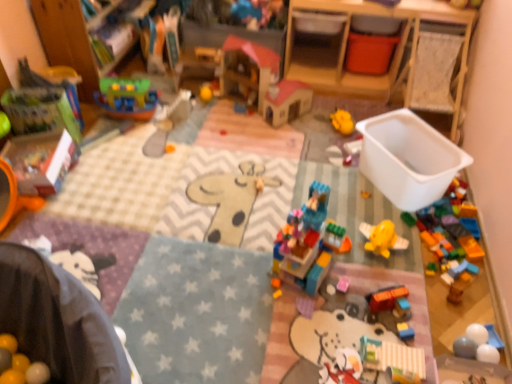
This screenshot has width=512, height=384. Find the location of `vacant area that lies between yellow matte ball at center, which is the 8th toy from bottom to top, and translucent plastic castle at center, marked as the third toy in a bottom-to-top arrangement`. vacant area that lies between yellow matte ball at center, which is the 8th toy from bottom to top, and translucent plastic castle at center, marked as the third toy in a bottom-to-top arrangement is located at coordinates (243, 170).